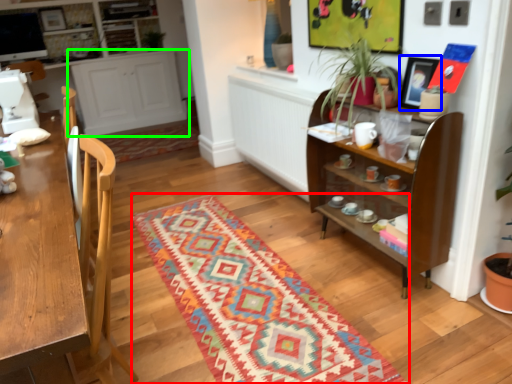
Question: Based on their relative distances, which object is farther from mat (highlighted by a red box)? Choose from picture frame (highlighted by a blue box) and cabinetry (highlighted by a green box).

Choices:
 (A) picture frame
 (B) cabinetry

Answer: (B)